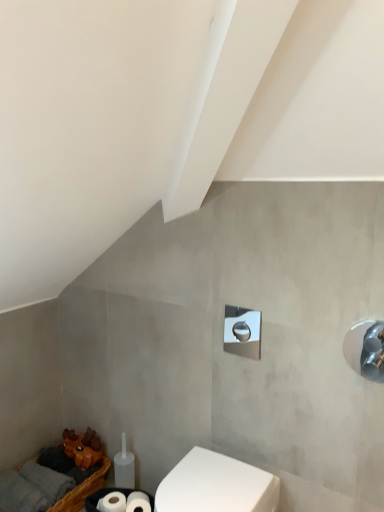
Question: Is point (193, 458) closer or farther from the camera than point (248, 310)?

Choices:
 (A) closer
 (B) farther

Answer: (B)

Question: Is white glossy toilet at lower center spatially inside polished chrome shower at center, marked as the second shower in a front-to-back arrangement, or outside of it?

Choices:
 (A) outside
 (B) inside

Answer: (A)

Question: Estimate the real-world distances between objects in this image. Which object is closer to the brown woven basket at lower left?

Choices:
 (A) white glossy toilet at lower center
 (B) polished chrome shower at center, which is the 1th shower in back-to-front order
 (C) polished chrome shower at right, arranged as the 2th shower when viewed from the left

Answer: (A)

Question: Which object is positioned closest to the white glossy toilet at lower center?

Choices:
 (A) polished chrome shower at center, marked as the second shower in a front-to-back arrangement
 (B) brown woven basket at lower left
 (C) polished chrome shower at right, the second shower in the back-to-front sequence

Answer: (A)